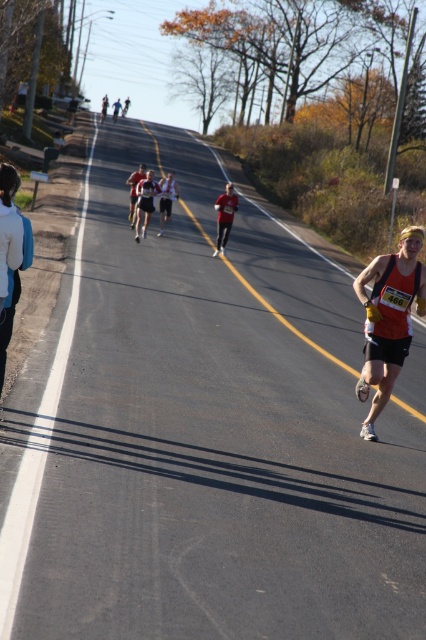
Question: Considering the real-world distances, which object is closest to the matte red running suit at center?

Choices:
 (A) red running outfit at center
 (B) white fleece jacket at left
 (C) red fabric runner at center

Answer: (C)

Question: Can you confirm if white fleece jacket at left is positioned to the left of red fabric runner at center?

Choices:
 (A) yes
 (B) no

Answer: (A)

Question: Is matte red running suit at center above matte red shirt at center?

Choices:
 (A) yes
 (B) no

Answer: (B)

Question: Which point is closer to the camera?

Choices:
 (A) (216, 205)
 (B) (141, 180)

Answer: (A)

Question: Which point is farther to the camera?

Choices:
 (A) red running outfit at center
 (B) matte red running suit at center
 (C) matte black tank top at right
 (D) matte red shirt at center

Answer: (D)

Question: Where is red fabric runner at center located in relation to matte red shirt at center in the image?

Choices:
 (A) left
 (B) right

Answer: (B)